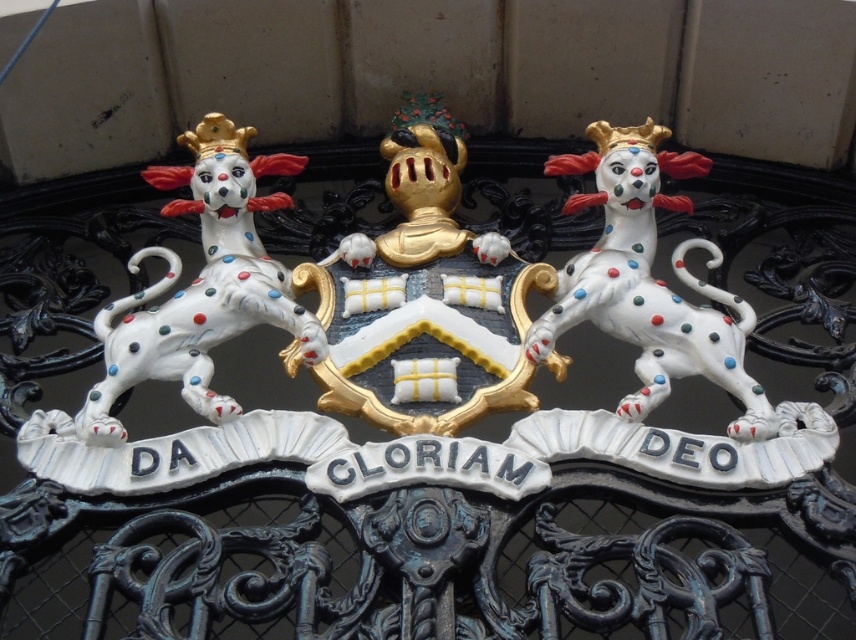
Based on the scene description, which object is positioned to the right of the other? Are the gold plated shield at center and polished ceramic dog at center arranged side by side?

The gold plated shield at center is to the left of polished ceramic dog at center, so the shield is on the left and the dog is on the right.